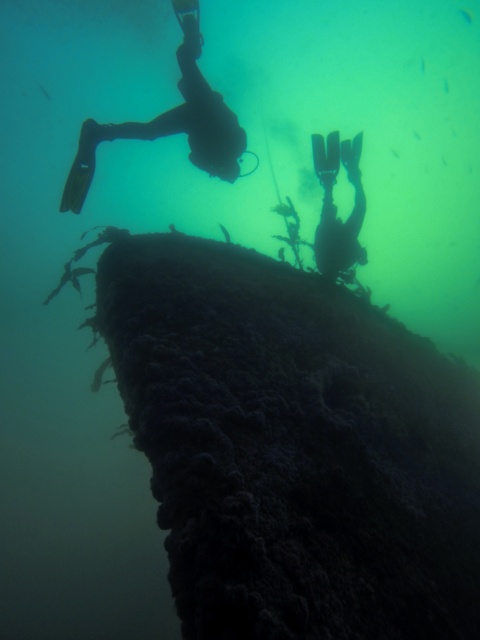
Question: Which object appears closest to the camera in this image?

Choices:
 (A) rough coral reef at center
 (B) black matte scuba diver at upper left

Answer: (A)

Question: Which point is closer to the camera?

Choices:
 (A) rough coral reef at center
 (B) silhouette flippers at center

Answer: (A)

Question: Is rough coral reef at center closer to camera compared to silhouette flippers at center?

Choices:
 (A) no
 (B) yes

Answer: (B)

Question: Is rough coral reef at center below silhouette flippers at center?

Choices:
 (A) no
 (B) yes

Answer: (B)

Question: Among these points, which one is nearest to the camera?

Choices:
 (A) (180, 129)
 (B) (332, 250)

Answer: (A)

Question: Is rough coral reef at center further to camera compared to black matte scuba diver at upper left?

Choices:
 (A) yes
 (B) no

Answer: (B)